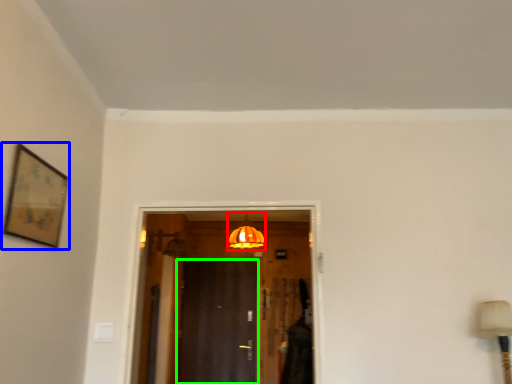
Question: Which is farther away from light fixture (highlighted by a red box)? picture frame (highlighted by a blue box) or door (highlighted by a green box)?

Choices:
 (A) picture frame
 (B) door

Answer: (A)